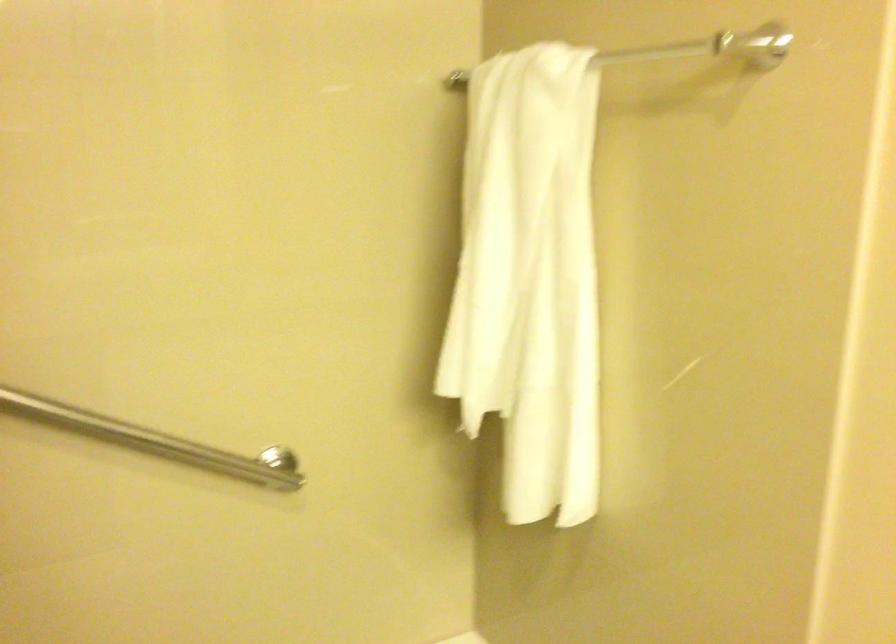
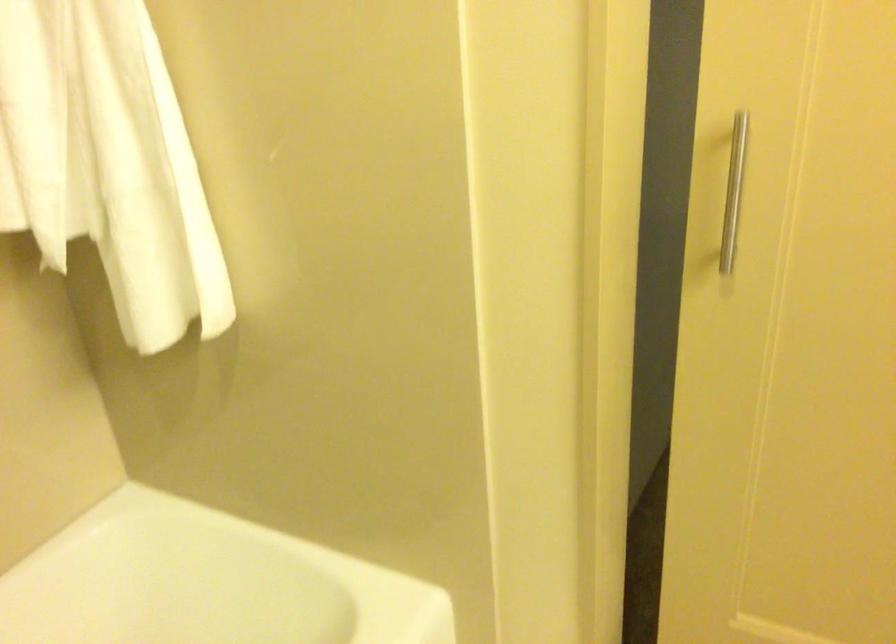
First-person continuous shooting, in which direction is the camera rotating?

The camera rotated toward right-down.